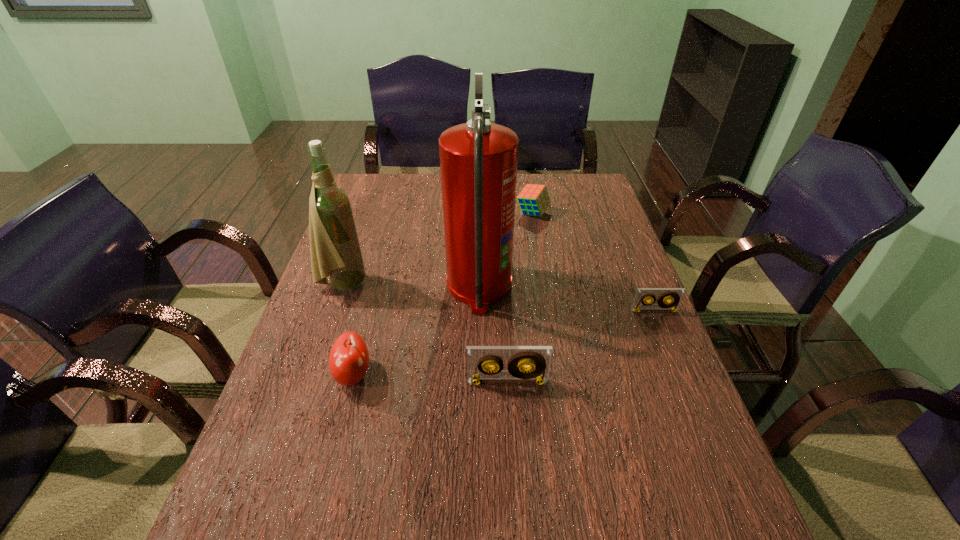
Find the location of a particular element. free space between the fire extinguisher and the nearer videotape is located at coordinates click(x=493, y=334).

The height and width of the screenshot is (540, 960). What are the coordinates of `vacant area between the taller videotape and the apple` in the screenshot? It's located at (430, 378).

Identify the location of free spot between the nearer videotape and the shortest object. (581, 346).

The width and height of the screenshot is (960, 540). Find the location of `object that can be found as the closest to the left videotape`. object that can be found as the closest to the left videotape is located at coordinates (478, 160).

In order to click on the second closest object to the left videotape in this screenshot , I will do `click(348, 360)`.

The height and width of the screenshot is (540, 960). What are the coordinates of `vacant space that satisfies the following two spatial constraints: 1. on the instruction side of the fire extinguisher; 2. on the front side of the apple` in the screenshot? It's located at (479, 374).

This screenshot has height=540, width=960. Find the location of `vacant space that satisfies the following two spatial constraints: 1. on the instruction side of the fire extinguisher; 2. on the front side of the apple`. vacant space that satisfies the following two spatial constraints: 1. on the instruction side of the fire extinguisher; 2. on the front side of the apple is located at coordinates (479, 374).

Find the location of `vacant space that satisfies the following two spatial constraints: 1. on the front-facing side of the fifth shortest object; 2. on the back side of the apple`. vacant space that satisfies the following two spatial constraints: 1. on the front-facing side of the fifth shortest object; 2. on the back side of the apple is located at coordinates (312, 374).